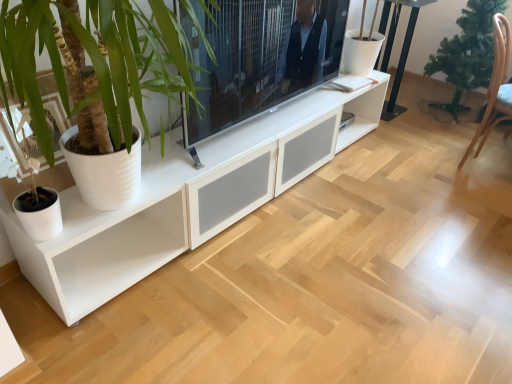
What do you see at coordinates (402, 65) in the screenshot? The image size is (512, 384). I see `black metal table at upper right` at bounding box center [402, 65].

Image resolution: width=512 pixels, height=384 pixels. What do you see at coordinates (467, 52) in the screenshot?
I see `green matte christmas tree at right` at bounding box center [467, 52].

This screenshot has height=384, width=512. I want to click on matte black tv at center, so click(260, 57).

Image resolution: width=512 pixels, height=384 pixels. I want to click on brown wooden armchair at right, so click(x=495, y=87).

In order to click on black metal table at upper right in this screenshot , I will do `click(402, 65)`.

From a real-world perspective, is white matte cabinet at center positioned over matte black tv at center based on gravity?

Yes, from a real-world perspective, white matte cabinet at center is on top of matte black tv at center.

Is white matte cabinet at center far away from matte black tv at center?

white matte cabinet at center is actually quite close to matte black tv at center.

Can you confirm if white matte cabinet at center is bigger than matte black tv at center?

Yes, white matte cabinet at center is bigger than matte black tv at center.

Who is shorter, white matte cabinet at center or matte black tv at center?

matte black tv at center is shorter.

Is green matte christmas tree at right located outside black metal table at upper right?

Indeed, green matte christmas tree at right is completely outside black metal table at upper right.

Is green matte christmas tree at right placed right next to black metal table at upper right?

No, green matte christmas tree at right is not in contact with black metal table at upper right.

Which object is positioned more to the right, green matte christmas tree at right or black metal table at upper right?

Positioned to the right is green matte christmas tree at right.

From the image's perspective, relative to black metal table at upper right, is green matte christmas tree at right above or below?

Based on their image positions, green matte christmas tree at right is located above black metal table at upper right.

Is black metal table at upper right in front of or behind white matte cabinet at center in the image?

Visually, black metal table at upper right is located behind white matte cabinet at center.

Which of these two, black metal table at upper right or white matte cabinet at center, stands taller?

white matte cabinet at center.

Which of these two, black metal table at upper right or white matte cabinet at center, is wider?

With larger width is white matte cabinet at center.

Would you consider black metal table at upper right to be distant from white matte cabinet at center?

Yes, black metal table at upper right and white matte cabinet at center are quite far apart.

How many degrees apart are the facing directions of green matte christmas tree at right and matte black tv at center?

The angle between the facing direction of green matte christmas tree at right and the facing direction of matte black tv at center is 92 degrees.

Does point (445, 38) lie in front of point (246, 109)?

No, (445, 38) is behind (246, 109).

Considering the sizes of objects green matte christmas tree at right and matte black tv at center in the image provided, who is shorter, green matte christmas tree at right or matte black tv at center?

matte black tv at center is shorter.

Can you confirm if green matte christmas tree at right is thinner than matte black tv at center?

Incorrect, the width of green matte christmas tree at right is not less than that of matte black tv at center.

From the image's perspective, is brown wooden armchair at right over matte black tv at center?

No, from the image's perspective, brown wooden armchair at right is not above matte black tv at center.

Between point (502, 51) and point (304, 7), which one is positioned in front?

The point (304, 7) is closer to the camera.

Between brown wooden armchair at right and matte black tv at center, which one has smaller width?

Thinner between the two is matte black tv at center.

From a real-world perspective, which object rests below the other?

brown wooden armchair at right, from a real-world perspective.

From a real-world perspective, is black metal table at upper right positioned under green matte christmas tree at right based on gravity?

Yes, from a real-world perspective, black metal table at upper right is below green matte christmas tree at right.

From the image's perspective, is black metal table at upper right over green matte christmas tree at right?

No.

Looking at the image, does black metal table at upper right seem bigger or smaller compared to green matte christmas tree at right?

Clearly, black metal table at upper right is smaller in size than green matte christmas tree at right.

Between black metal table at upper right and green matte christmas tree at right, which one has more height?

green matte christmas tree at right.

From a real-world perspective, who is located higher, matte black tv at center or brown wooden armchair at right?

In real-world perspective, matte black tv at center is above.

Does matte black tv at center turn towards brown wooden armchair at right?

No, matte black tv at center is not oriented towards brown wooden armchair at right.

Considering the relative sizes of matte black tv at center and brown wooden armchair at right in the image provided, is matte black tv at center shorter than brown wooden armchair at right?

Correct, matte black tv at center is not as tall as brown wooden armchair at right.

The width and height of the screenshot is (512, 384). Find the location of `cabinetry that appears on the left of matte black tv at center`. cabinetry that appears on the left of matte black tv at center is located at coordinates (184, 200).

Image resolution: width=512 pixels, height=384 pixels. I want to click on table below the green matte christmas tree at right (from the image's perspective), so click(x=402, y=65).

Considering their positions, is white matte cabinet at center positioned further to black metal table at upper right than matte black tv at center?

white matte cabinet at center.

Considering their positions, is brown wooden armchair at right positioned further to black metal table at upper right than matte black tv at center?

matte black tv at center is further to black metal table at upper right.

Looking at the image, which one is located closer to white matte cabinet at center, green matte christmas tree at right or brown wooden armchair at right?

Based on the image, brown wooden armchair at right appears to be nearer to white matte cabinet at center.

Estimate the real-world distances between objects in this image. Which object is further from brown wooden armchair at right, matte black tv at center or black metal table at upper right?

The object further to brown wooden armchair at right is matte black tv at center.

Consider the image. Based on their spatial positions, is matte black tv at center or brown wooden armchair at right further from green matte christmas tree at right?

matte black tv at center is further to green matte christmas tree at right.

Which object lies nearer to the anchor point green matte christmas tree at right, white matte cabinet at center or matte black tv at center?

white matte cabinet at center lies closer to green matte christmas tree at right than the other object.

Based on their spatial positions, is matte black tv at center or black metal table at upper right closer to white matte cabinet at center?

matte black tv at center is closer to white matte cabinet at center.

Considering their positions, is brown wooden armchair at right positioned closer to matte black tv at center than white matte cabinet at center?

white matte cabinet at center.

The height and width of the screenshot is (384, 512). What are the coordinates of `television between white matte cabinet at center and black metal table at upper right from front to back` in the screenshot? It's located at (260, 57).

Identify the location of table between matte black tv at center and brown wooden armchair at right in the horizontal direction. Image resolution: width=512 pixels, height=384 pixels. (402, 65).

You are a GUI agent. You are given a task and a screenshot of the screen. Output one action in this format:
    pyautogui.click(x=<x>, y=<y>)
    Task: Click on the armchair situated between white matte cabinet at center and green matte christmas tree at right from left to right
    This screenshot has height=384, width=512.
    Given the screenshot: What is the action you would take?
    pyautogui.click(x=495, y=87)

This screenshot has width=512, height=384. Identify the location of table between matte black tv at center and green matte christmas tree at right from left to right. (402, 65).